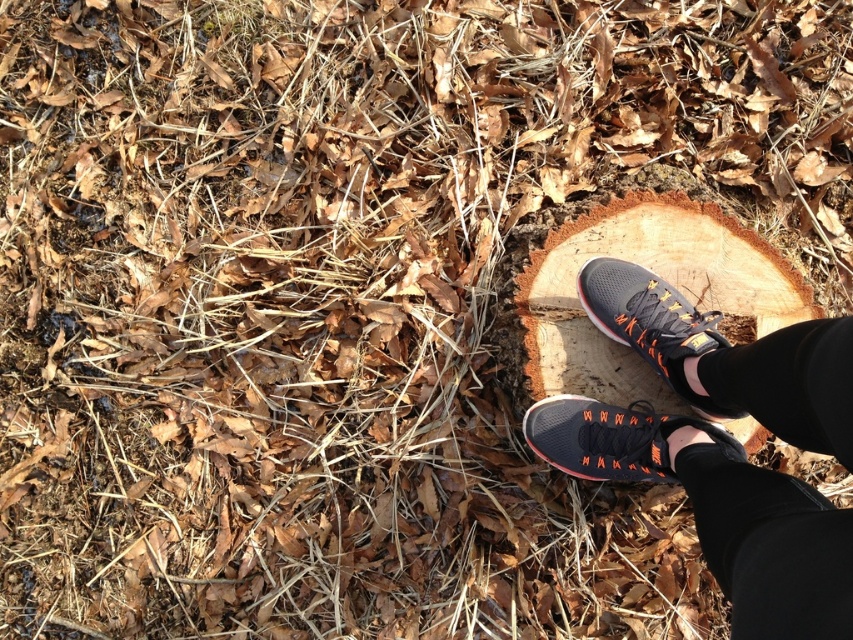
You are navigating through a forest path and need to place a small marker between the two points, point (695,291) and point (581,406). To ensure it is visible from the front, where should you place it relative to these points?

Place the marker in front of point (695,291) and behind point (581,406) since point (695,291) is behind point (581,406).

You are a hiker trying to step onto the wooden stump at center from the orange mesh sneaker at lower right. Can you do it without slipping? Explain why based on the scene details.

The wooden stump at center is located above the orange mesh sneaker at lower right. Since the stump is elevated, you can step onto it from the sneaker. The textured sole of the orange mesh sneaker at lower right provides good grip, which should prevent slipping on the rough, uneven surface of the stump.

You are a hiker who just found a hidden treasure at the point marked as point (613,438). You want to pick it up. Which object from the following is the closest to your treasure? The options are the orange mesh sneaker at lower right and the black leggings at ankles.

The orange mesh sneaker at lower right is the closest to the treasure at point (613,438).